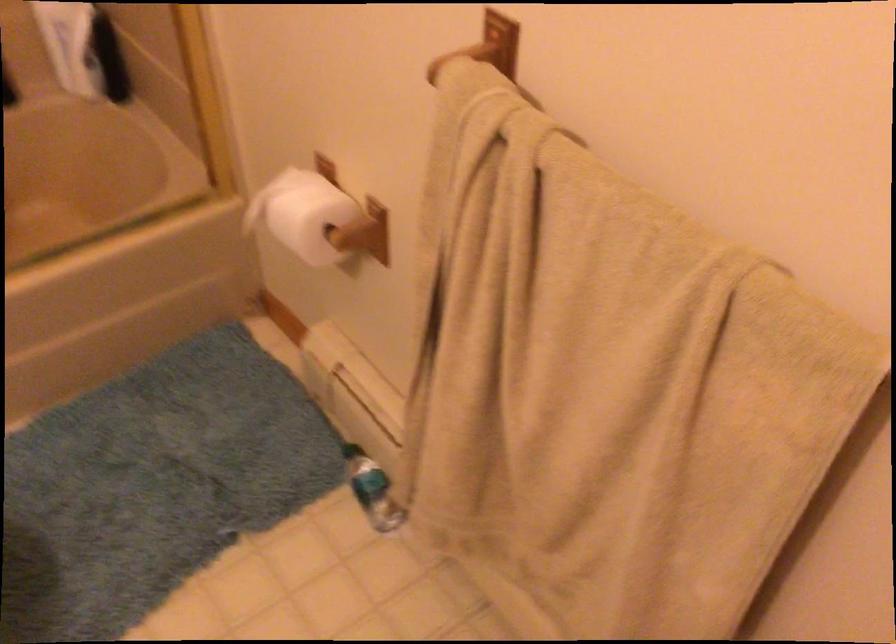
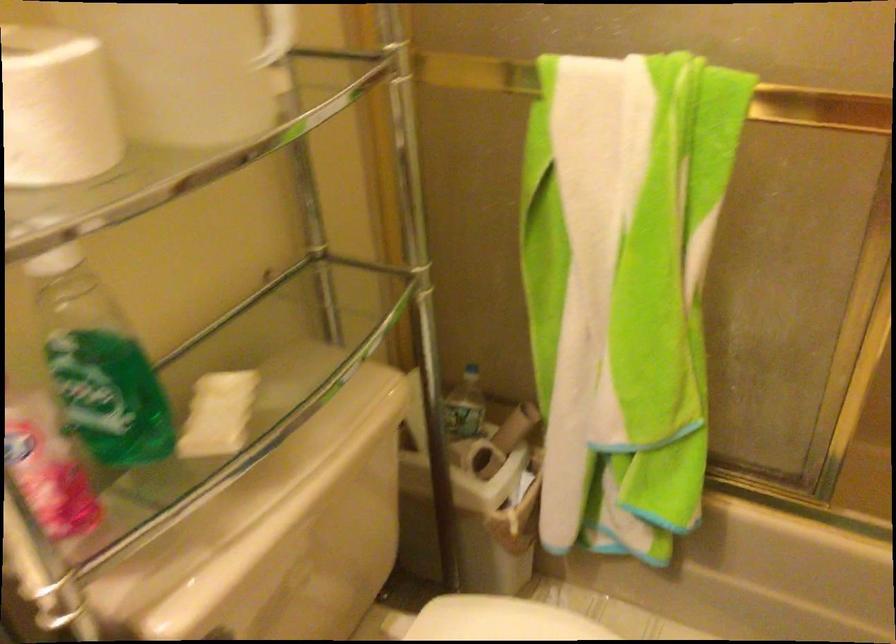
Question: The camera is either moving clockwise (left) or counter-clockwise (right) around the object. The first image is from the beginning of the video and the second image is from the end. Is the camera moving left or right when shooting the video?

Choices:
 (A) Left
 (B) Right

Answer: (B)